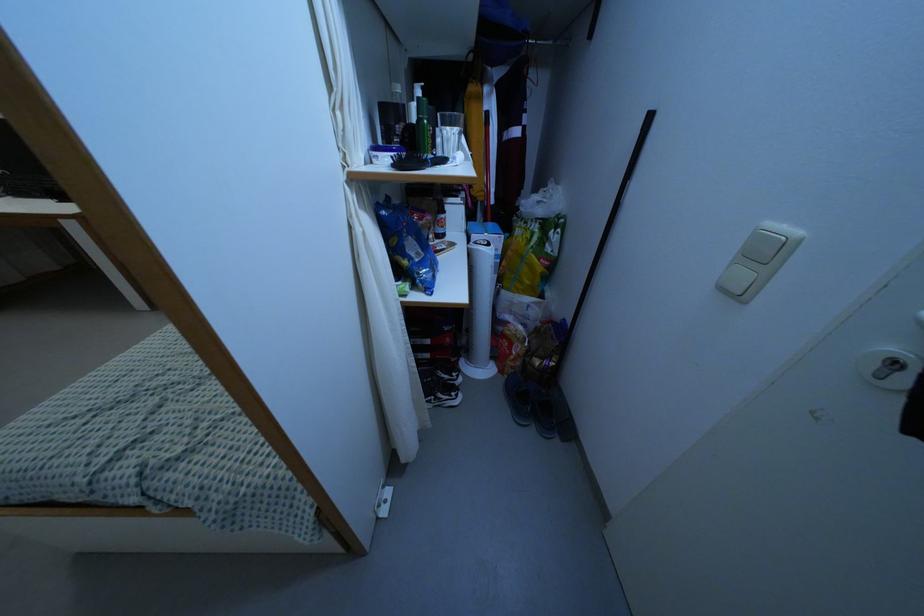
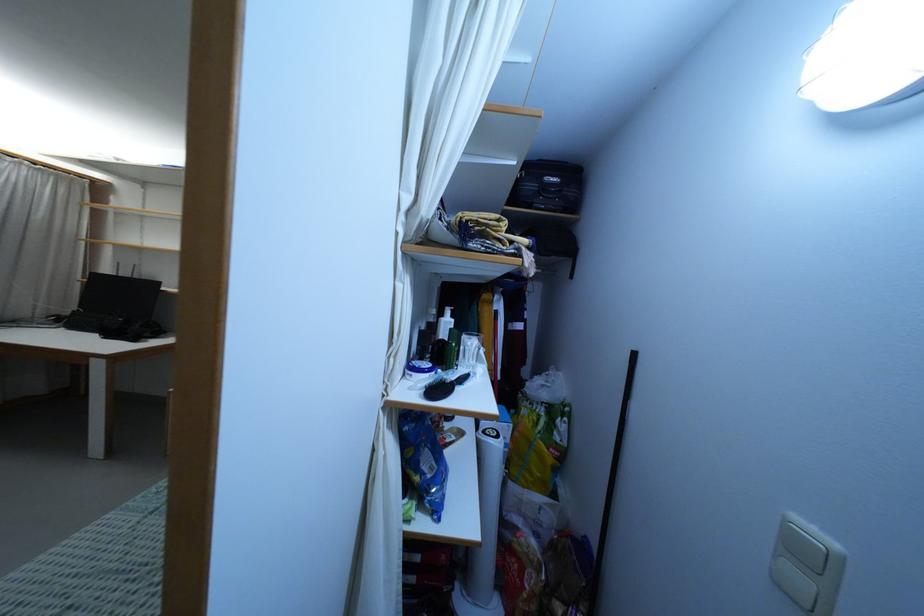
In the second image, find the point that corresponds to [434,156] in the first image.

(456, 365)